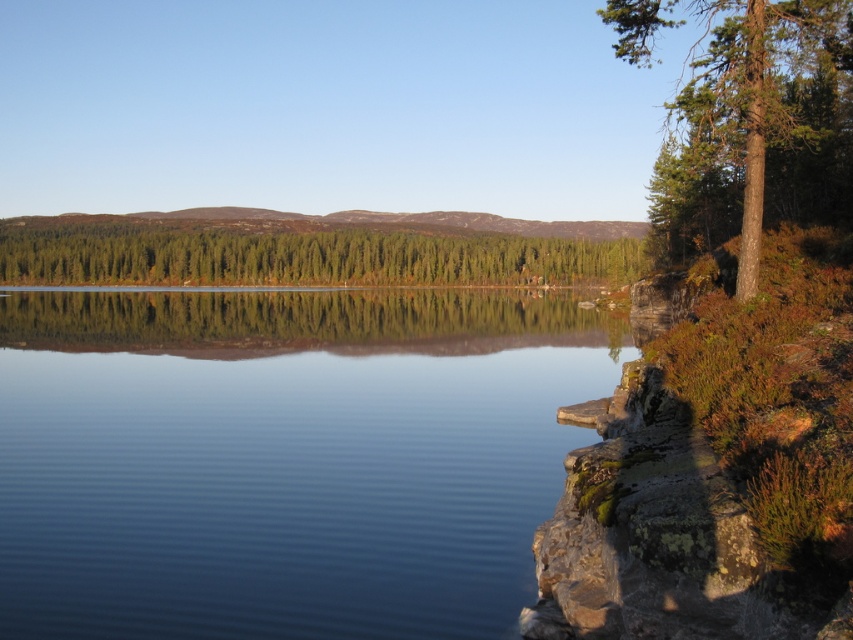
You are standing on the rocky shoreline and want to walk towards the brown textured tree at right. Which direction should you head to first, towards the clear water at center or away from it?

You should head towards the clear water at center first because it is closer to you than the brown textured tree at right, so moving towards it will bring you closer to your destination.

Consider the image. You are standing at the edge of the water in the serene natural landscape. You notice two points marked in the image. Which point, point [62,547] or point [675,253], is closer to you?

Point [62,547] is closer to the viewer than point [675,253].